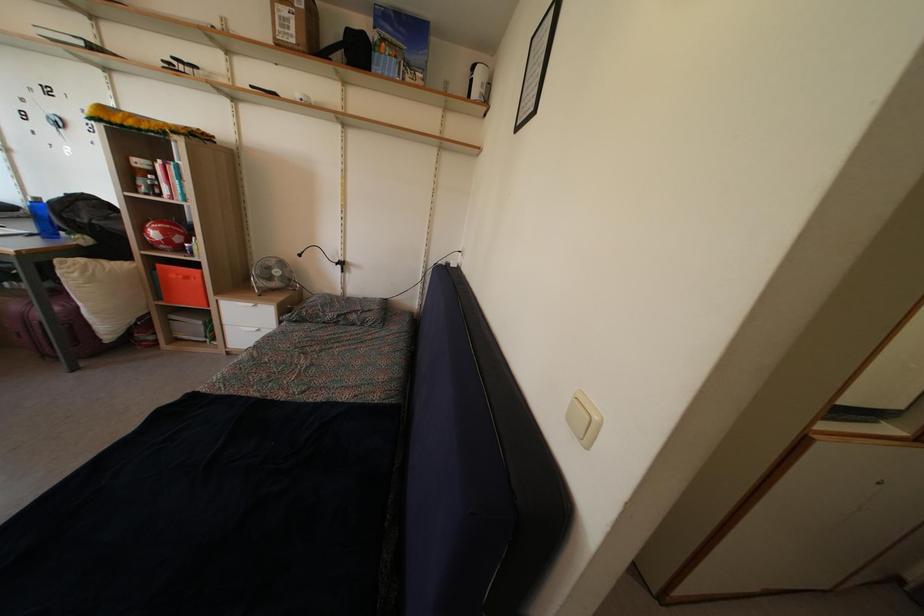
Find where to open the blue water bottle. Please return your answer as a coordinate pair (x, y).

(42, 217)